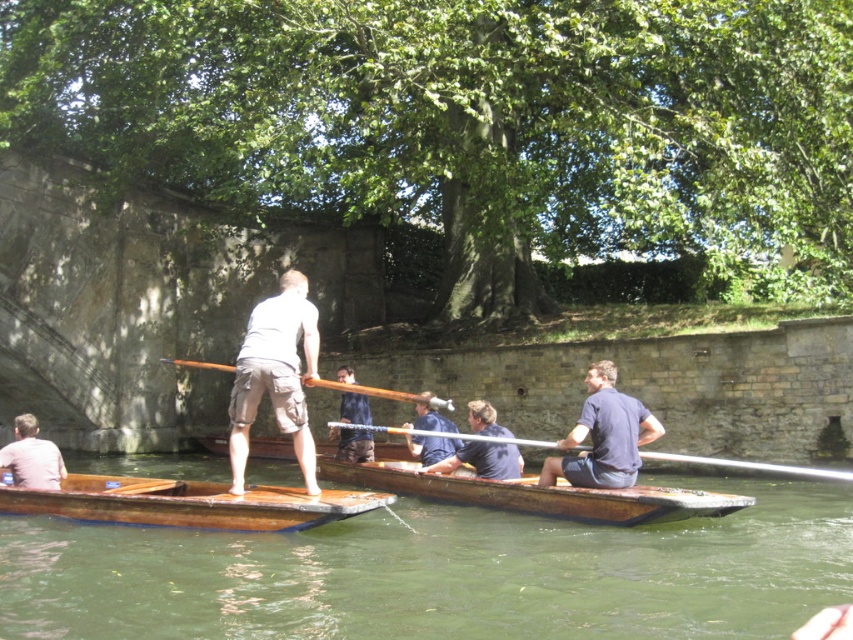
Please check the objects in the scene. Which object is wider, the wooden canoe at center or the wooden at center?

The wooden canoe at center is wider than the wooden at center.

You are standing on the bank of the river and see two points marked on the water surface. The first point is at coordinates point (369, 440) and the second point is at point (380, 428). Which point is closer to you?

Point (369, 440) is closer to you because it is further to the viewer than point (380, 428).